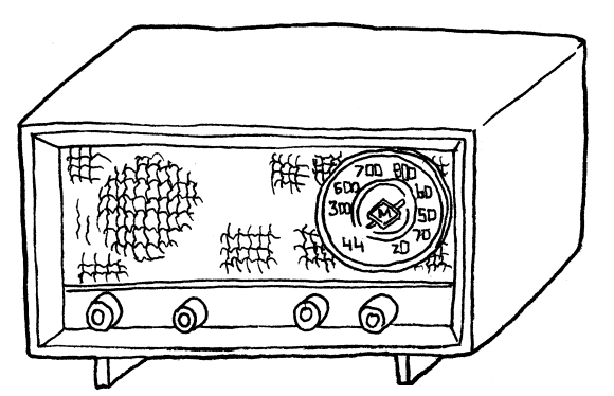
Where is `old timey radio`? old timey radio is located at coordinates [x=301, y=89].